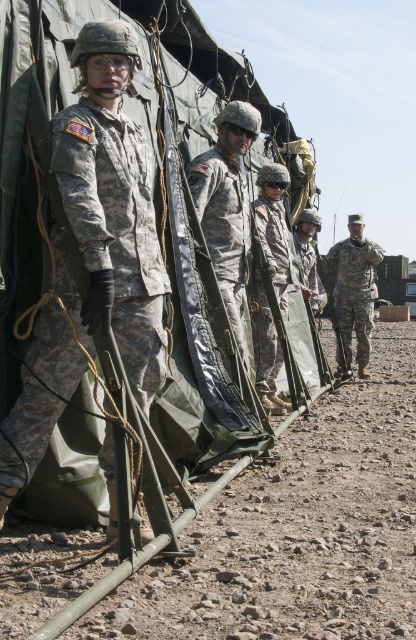
You are a photographer trying to capture a group photo of the soldiers. You notice two soldiers wearing camouflage uniforms, one at the center labeled as camouflage fabric uniform at center and another at the right labeled as camouflage uniform at right. To ensure both soldiers are in focus, you need to know which one is closer to the camera. Can you determine which soldier is closer based on their uniform widths?

The camouflage fabric uniform at center has a lesser width compared to the camouflage uniform at right, which indicates it is farther away from the camera. Therefore, the camouflage uniform at right is closer to the camera.